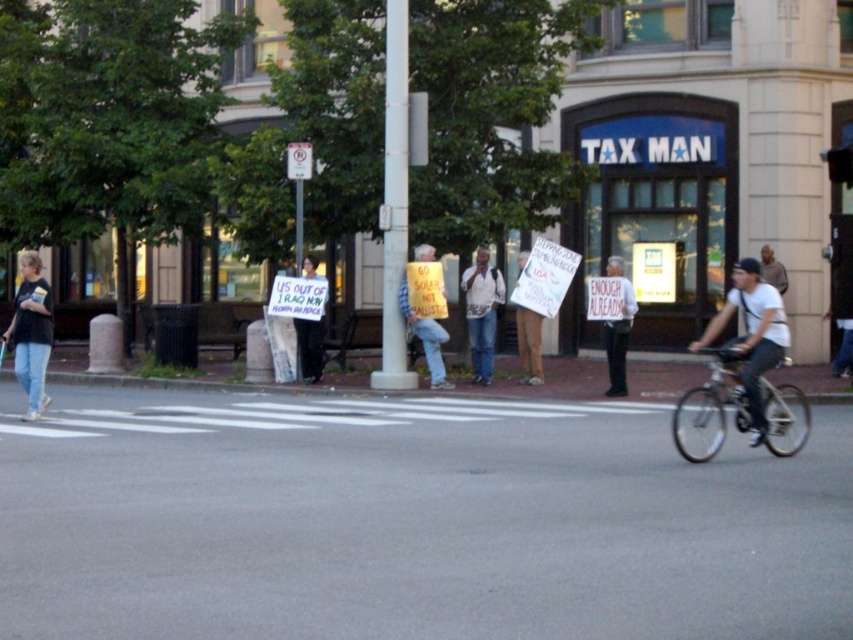
Question: Can you confirm if denim jeans at left is positioned to the right of white shirt at center?

Choices:
 (A) no
 (B) yes

Answer: (A)

Question: Which of the following is the farthest from the observer?

Choices:
 (A) (703, 332)
 (B) (689, 420)
 (C) (619, 368)
 (D) (477, 276)

Answer: (A)

Question: Which object is positioned farthest from the white paper sign at center?

Choices:
 (A) white shirt at center
 (B) yellow paper sign at center

Answer: (B)

Question: Does denim jeans at left have a lesser width compared to white paper sign at center?

Choices:
 (A) no
 (B) yes

Answer: (A)

Question: Where is yellow paper sign at center located in relation to white paper sign at center in the image?

Choices:
 (A) right
 (B) left

Answer: (B)

Question: Which point appears closest to the camera in this image?

Choices:
 (A) (15, 304)
 (B) (436, 323)
 (C) (809, 432)

Answer: (C)